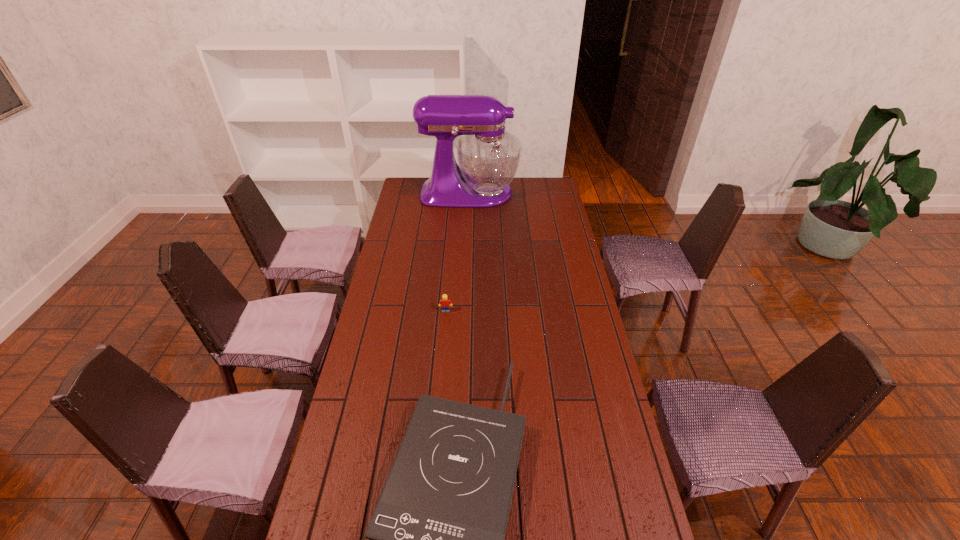
The height and width of the screenshot is (540, 960). I want to click on vacant space at the right edge of the desktop, so click(582, 288).

At what (x,y) coordinates should I click in order to perform the action: click on free space at the far right corner. Please return your answer as a coordinate pair (x, y). Looking at the image, I should click on (541, 198).

Locate an element on the screen. vacant space that's between the second farthest object and the tallest object is located at coordinates (458, 252).

The height and width of the screenshot is (540, 960). I want to click on unoccupied position between the second shortest object and the mixer, so click(x=458, y=252).

The image size is (960, 540). Identify the location of vacant space that's between the second tallest object and the farthest object. [458, 252].

Locate an element on the screen. Image resolution: width=960 pixels, height=540 pixels. vacant space in between the mixer and the second nearest object is located at coordinates (458, 252).

The width and height of the screenshot is (960, 540). I want to click on object that is the second closest one to the tallest object, so click(436, 537).

Where is `the closest object to the tallest object`? The height and width of the screenshot is (540, 960). the closest object to the tallest object is located at coordinates (444, 302).

Identify the location of free space that satisfies the following two spatial constraints: 1. at the bowl opening of the mixer; 2. on the front-facing side of the second farthest object. This screenshot has width=960, height=540. (466, 311).

Locate an element on the screen. This screenshot has width=960, height=540. vacant area in the image that satisfies the following two spatial constraints: 1. at the bowl opening of the farthest object; 2. on the front-facing side of the Lego is located at coordinates (466, 311).